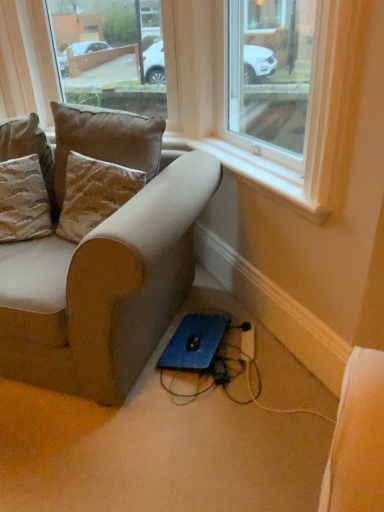
Question: From their relative heights in the image, would you say clear glass window at upper center, which is the first window from left to right, is taller or shorter than velvet brown pillow at upper left, acting as the first pillow starting from the right?

Choices:
 (A) tall
 (B) short

Answer: (A)

Question: Is clear glass window at upper center, which ranks as the second window in right-to-left order, wider or thinner than velvet brown pillow at upper left, acting as the first pillow starting from the right?

Choices:
 (A) wide
 (B) thin

Answer: (A)

Question: Considering the real-world distances, which object is closest to the black plastic extension cord at lower center?

Choices:
 (A) blue matte laptop at lower center
 (B) velvet brown pillow at upper left, acting as the first pillow starting from the right
 (C) suede-like beige couch at lower left
 (D) clear glass window at upper center, positioned as the second window in left-to-right order
 (E) white plastic window sill at upper center

Answer: (A)

Question: Based on their relative distances, which object is farther from the clear glass window at upper center, positioned as the second window in left-to-right order?

Choices:
 (A) blue matte laptop at lower center
 (B) textured beige pillow at upper left, the first pillow in the left-to-right sequence
 (C) velvet brown pillow at upper left, which is counted as the second pillow, starting from the left
 (D) clear glass window at upper center, which is the first window from left to right
 (E) suede-like beige couch at lower left

Answer: (A)